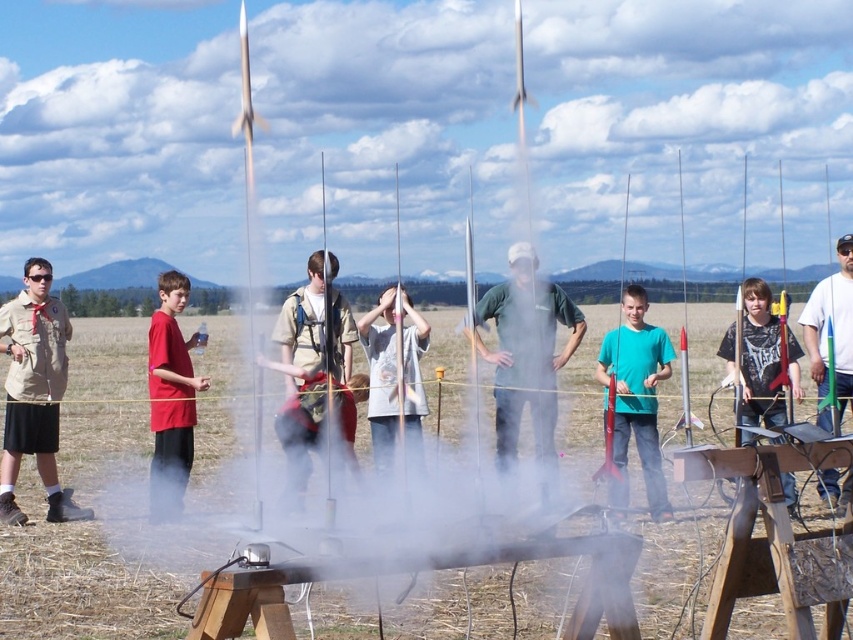
This screenshot has height=640, width=853. What do you see at coordinates (170, 397) in the screenshot?
I see `matte red shirt at center` at bounding box center [170, 397].

Based on the photo, is matte red shirt at center closer to camera compared to matte black shirt at center?

No, it is not.

Measure the distance between point (167, 305) and camera.

Point (167, 305) and camera are 31.00 feet apart.

Locate an element on the screen. The height and width of the screenshot is (640, 853). matte red shirt at center is located at coordinates (170, 397).

Can you confirm if green matte shirt at center is positioned below matte red shirt at center?

Indeed, green matte shirt at center is positioned under matte red shirt at center.

Which of these two, green matte shirt at center or matte red shirt at center, stands taller?

With more height is green matte shirt at center.

Who is more distant from viewer, [546,305] or [155,410]?

The point [546,305] is more distant.

This screenshot has height=640, width=853. In order to click on green matte shirt at center in this screenshot , I will do `click(526, 358)`.

Which is below, khaki uniform at left or white matte t-shirt at center?

white matte t-shirt at center

Is khaki uniform at left above white matte t-shirt at center?

Yes, khaki uniform at left is above white matte t-shirt at center.

Does point (64, 346) lie behind point (393, 433)?

No, (64, 346) is in front of (393, 433).

Where is `khaki uniform at left`? The image size is (853, 640). khaki uniform at left is located at coordinates (33, 392).